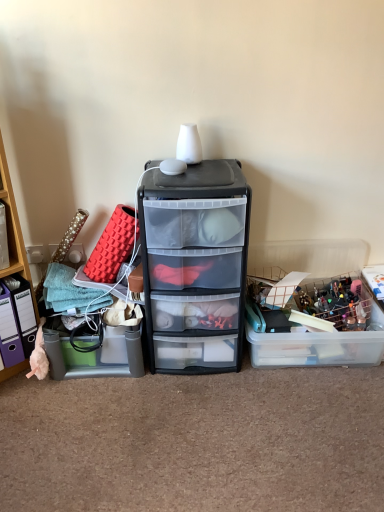
Question: Based on their sizes in the image, would you say translucent plastic storage box at right, arranged as the second storage box when viewed from the left, is bigger or smaller than teal plastic bin at left?

Choices:
 (A) big
 (B) small

Answer: (B)

Question: Considering the positions of translucent plastic storage box at right, arranged as the second storage box when viewed from the left, and teal plastic bin at left in the image, is translucent plastic storage box at right, arranged as the second storage box when viewed from the left, taller or shorter than teal plastic bin at left?

Choices:
 (A) short
 (B) tall

Answer: (A)

Question: Considering the real-world distances, which object is farthest from the transparent plastic drawer at center?

Choices:
 (A) translucent plastic storage box at right, the first storage box viewed from the right
 (B) translucent plastic storage box at left, which appears as the 1th storage box when viewed from the left
 (C) teal plastic bin at left

Answer: (C)

Question: Which is farther from the translucent plastic storage box at right, arranged as the second storage box when viewed from the left?

Choices:
 (A) translucent plastic storage box at left, which appears as the 1th storage box when viewed from the left
 (B) transparent plastic drawer at center
 (C) teal plastic bin at left

Answer: (C)